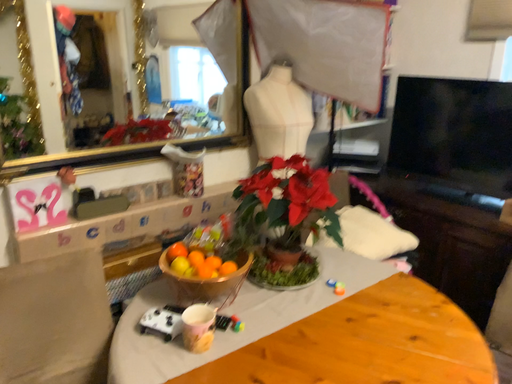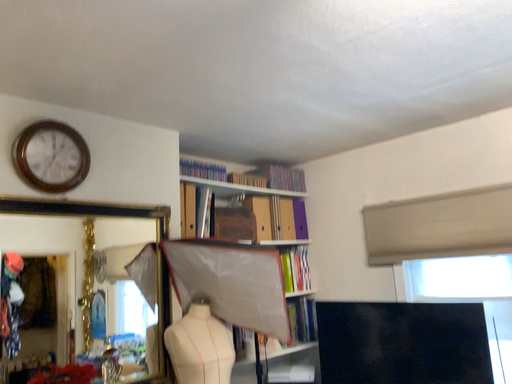
Question: Which way did the camera rotate in the video?

Choices:
 (A) rotated upward
 (B) rotated downward

Answer: (A)